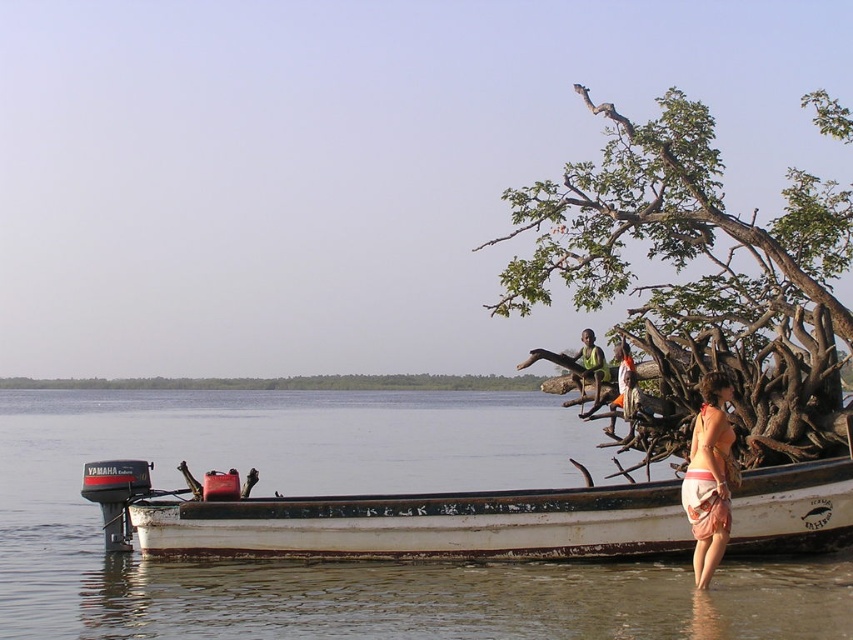
Which is above, white matte water at lower left or green fabric shirt at center?

green fabric shirt at center

Between white matte water at lower left and green fabric shirt at center, which one appears on the left side from the viewer's perspective?

white matte water at lower left is more to the left.

Who is more forward, (181, 445) or (581, 387)?

Point (581, 387) is in front.

At what (x,y) coordinates should I click in order to perform the action: click on white matte water at lower left. Please return your answer as a coordinate pair (x, y). Looking at the image, I should click on (349, 493).

Who is lower down, green leafy tree at upper right or pink fabric bikini at lower right?

pink fabric bikini at lower right is below.

Is point (741, 269) closer to viewer compared to point (724, 442)?

No, (741, 269) is behind (724, 442).

Which is in front, point (643, 204) or point (727, 449)?

Point (727, 449) is in front.

At what (x,y) coordinates should I click in order to perform the action: click on green leafy tree at upper right. Please return your answer as a coordinate pair (x, y). Image resolution: width=853 pixels, height=640 pixels. Looking at the image, I should click on (698, 280).

Does point (657, 362) come farther from viewer compared to point (598, 396)?

No, it is not.

Can you confirm if green leafy tree at upper right is shorter than green fabric shirt at center?

Incorrect, green leafy tree at upper right's height does not fall short of green fabric shirt at center's.

Who is more forward, [778,353] or [602,381]?

Point [778,353] is more forward.

Locate an element on the screen. The width and height of the screenshot is (853, 640). green leafy tree at upper right is located at coordinates (698, 280).